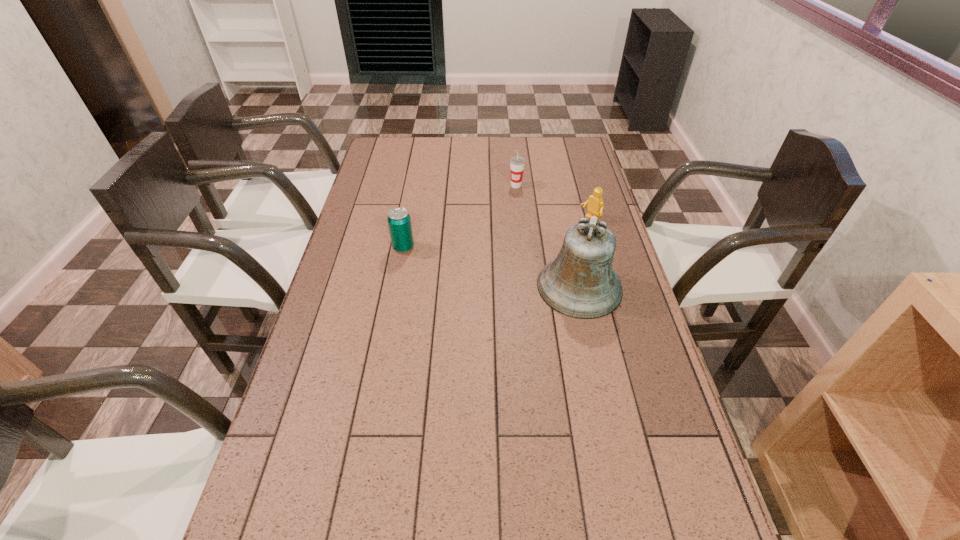
The height and width of the screenshot is (540, 960). Identify the location of vacant space at the right edge of the desktop. (654, 358).

In the image, there is a desktop. Where is `free space at the far left corner`? The height and width of the screenshot is (540, 960). free space at the far left corner is located at coordinates (382, 139).

Image resolution: width=960 pixels, height=540 pixels. What are the coordinates of `free point at the far right corner` in the screenshot? It's located at (577, 152).

The width and height of the screenshot is (960, 540). Identify the location of vacant space at the near right corner. (631, 522).

At what (x,y) coordinates should I click in order to perform the action: click on free space between the second farthest object and the second object from left to right. Please return your answer as a coordinate pair (x, y). This screenshot has width=960, height=540. Looking at the image, I should click on (553, 202).

Find the location of a particular element. vacant area between the third object from right to left and the Lego is located at coordinates (553, 202).

At what (x,y) coordinates should I click in order to perform the action: click on blank region between the second farthest object and the leftmost object. Please return your answer as a coordinate pair (x, y). Image resolution: width=960 pixels, height=540 pixels. Looking at the image, I should click on (496, 233).

The width and height of the screenshot is (960, 540). What are the coordinates of `free space between the third farthest object and the cup` in the screenshot? It's located at (460, 217).

You are a GUI agent. You are given a task and a screenshot of the screen. Output one action in this format:
    pyautogui.click(x=<x>, y=<y>)
    Task: Click on the free spot between the tallest object and the leftmost object
    This screenshot has height=540, width=960.
    Given the screenshot: What is the action you would take?
    pyautogui.click(x=492, y=267)

This screenshot has width=960, height=540. Identify the location of free space that is in between the nearest object and the second object from left to right. (548, 236).